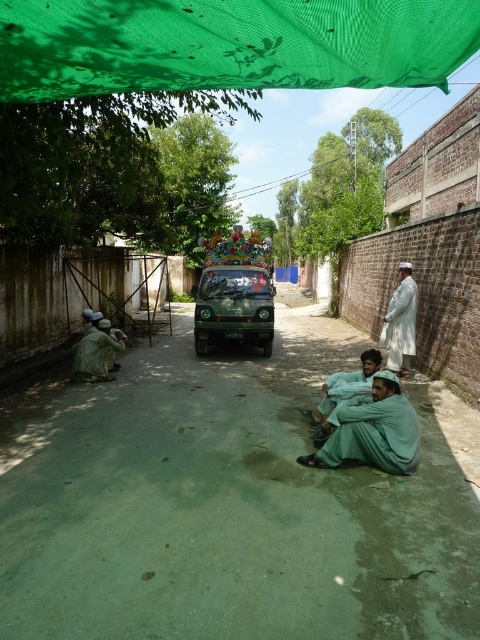
Is green mesh canopy at upper center to the right of white cotton robe at right from the viewer's perspective?

In fact, green mesh canopy at upper center is to the left of white cotton robe at right.

Who is positioned more to the left, green mesh canopy at upper center or white cotton robe at right?

Positioned to the left is green mesh canopy at upper center.

Between point (236, 4) and point (384, 339), which one is positioned behind?

Positioned behind is point (384, 339).

Locate an element on the screen. This screenshot has height=640, width=480. green mesh canopy at upper center is located at coordinates (228, 44).

Is green cotton robe at lower center thinner than white cotton robe at right?

In fact, green cotton robe at lower center might be wider than white cotton robe at right.

Between green cotton robe at lower center and white cotton robe at right, which one is positioned higher?

white cotton robe at right is higher up.

The width and height of the screenshot is (480, 640). What are the coordinates of `green cotton robe at lower center` in the screenshot? It's located at (375, 435).

Is green matte jeep at center thinner than green fabric robe at lower center?

Yes.

Which is above, green matte jeep at center or green fabric robe at lower center?

Positioned higher is green matte jeep at center.

Between point (202, 273) and point (330, 396), which one is positioned behind?

Positioned behind is point (202, 273).

What are the coordinates of `green matte jeep at center` in the screenshot? It's located at (233, 307).